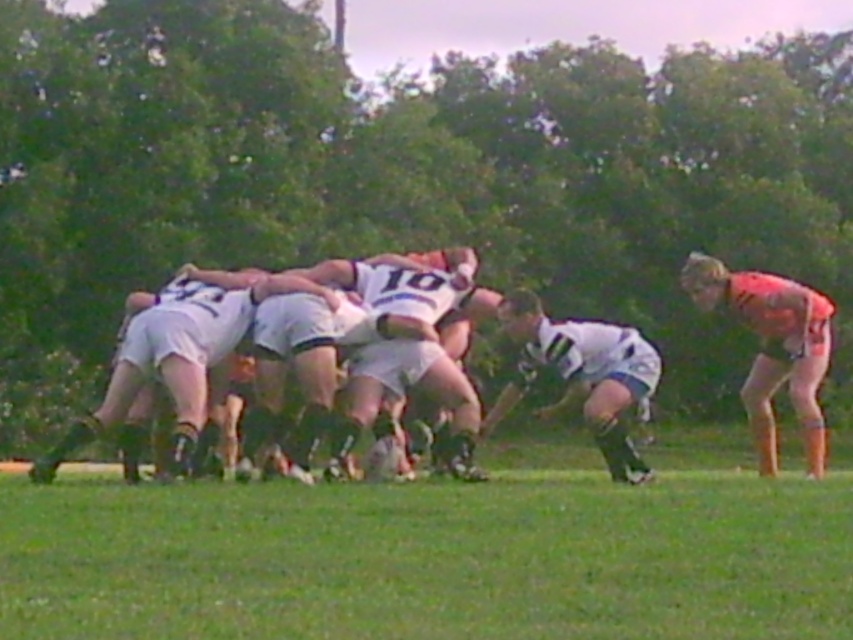
Does point (22, 572) lie in front of point (368, 289)?

Yes.

Between green grass at center and white matte rugby ball at center, which one is positioned lower?

green grass at center is below.

Which is in front, point (3, 534) or point (402, 280)?

Point (3, 534) is more forward.

Locate an element on the screen. green grass at center is located at coordinates (428, 557).

In the scene shown: Is green grass at center to the right of white matte jersey at center from the viewer's perspective?

In fact, green grass at center is to the left of white matte jersey at center.

Is green grass at center positioned at the back of white matte jersey at center?

That is False.

I want to click on green grass at center, so click(x=428, y=557).

Is white matte rugby ball at center bigger than white matte jersey at center?

No, white matte rugby ball at center is not bigger than white matte jersey at center.

Is point (376, 308) closer to camera compared to point (608, 456)?

No, (376, 308) is behind (608, 456).

Locate an element on the screen. The image size is (853, 640). white matte rugby ball at center is located at coordinates (413, 344).